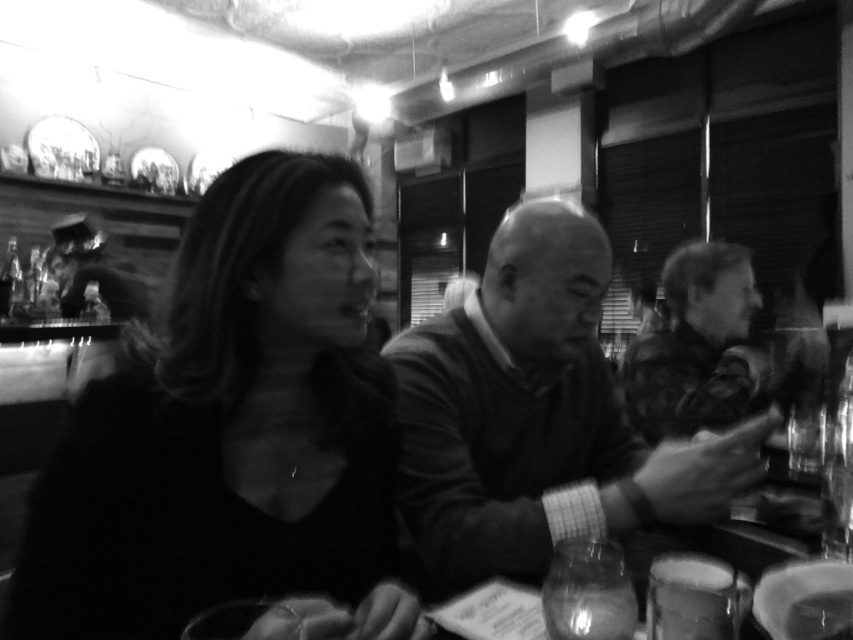
Who is positioned more to the left, smooth black shirt at center or smooth sweater at center?

From the viewer's perspective, smooth black shirt at center appears more on the left side.

At what (x,y) coordinates should I click in order to perform the action: click on smooth black shirt at center. Please return your answer as a coordinate pair (x, y). The height and width of the screenshot is (640, 853). Looking at the image, I should click on (231, 429).

In order to click on smooth black shirt at center in this screenshot , I will do `click(231, 429)`.

What do you see at coordinates (538, 416) in the screenshot? I see `smooth sweater at center` at bounding box center [538, 416].

Is smooth sweater at center further to camera compared to camouflage jacket at right?

No, smooth sweater at center is in front of camouflage jacket at right.

Who is more distant from viewer, (502,301) or (721,337)?

The point (721,337) is more distant.

At what (x,y) coordinates should I click in order to perform the action: click on smooth sweater at center. Please return your answer as a coordinate pair (x, y). Image resolution: width=853 pixels, height=640 pixels. Looking at the image, I should click on (538, 416).

In the scene shown: Between smooth black shirt at center and camouflage jacket at right, which one appears on the right side from the viewer's perspective?

Positioned to the right is camouflage jacket at right.

Does point (202, 346) come in front of point (730, 401)?

Yes, it is.

The width and height of the screenshot is (853, 640). I want to click on smooth black shirt at center, so click(231, 429).